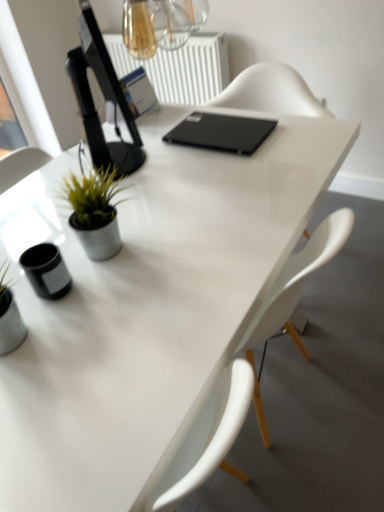
Question: Can you confirm if black glossy computer monitor at upper left is shorter than white plastic radiator at upper center?

Choices:
 (A) yes
 (B) no

Answer: (B)

Question: Is the position of black glossy computer monitor at upper left more distant than that of white plastic radiator at upper center?

Choices:
 (A) no
 (B) yes

Answer: (A)

Question: Considering the relative sizes of black glossy computer monitor at upper left and white plastic radiator at upper center in the image provided, is black glossy computer monitor at upper left taller than white plastic radiator at upper center?

Choices:
 (A) no
 (B) yes

Answer: (B)

Question: Could you tell me if black glossy computer monitor at upper left is turned towards white plastic radiator at upper center?

Choices:
 (A) no
 (B) yes

Answer: (A)

Question: From a real-world perspective, is black glossy computer monitor at upper left over white plastic radiator at upper center?

Choices:
 (A) no
 (B) yes

Answer: (B)

Question: Is white plastic radiator at upper center wider or thinner than black glossy computer monitor at upper left?

Choices:
 (A) thin
 (B) wide

Answer: (A)

Question: Is white plastic radiator at upper center spatially inside black glossy computer monitor at upper left, or outside of it?

Choices:
 (A) outside
 (B) inside

Answer: (A)

Question: In the image, is white plastic radiator at upper center positioned in front of or behind black glossy computer monitor at upper left?

Choices:
 (A) behind
 (B) front

Answer: (A)

Question: From a real-world perspective, relative to black glossy computer monitor at upper left, is white plastic radiator at upper center vertically above or below?

Choices:
 (A) above
 (B) below

Answer: (B)

Question: Based on their sizes in the image, would you say green matte plant at left is bigger or smaller than transparent glass window screen at upper left?

Choices:
 (A) small
 (B) big

Answer: (A)

Question: Is green matte plant at left wider or thinner than transparent glass window screen at upper left?

Choices:
 (A) thin
 (B) wide

Answer: (A)

Question: From a real-world perspective, is green matte plant at left above or below transparent glass window screen at upper left?

Choices:
 (A) above
 (B) below

Answer: (A)

Question: Considering the positions of green matte plant at left and transparent glass window screen at upper left in the image, is green matte plant at left taller or shorter than transparent glass window screen at upper left?

Choices:
 (A) tall
 (B) short

Answer: (B)

Question: Is black glossy computer monitor at upper left to the left or to the right of transparent glass window screen at upper left in the image?

Choices:
 (A) right
 (B) left

Answer: (A)

Question: Is black glossy computer monitor at upper left wider or thinner than transparent glass window screen at upper left?

Choices:
 (A) thin
 (B) wide

Answer: (B)